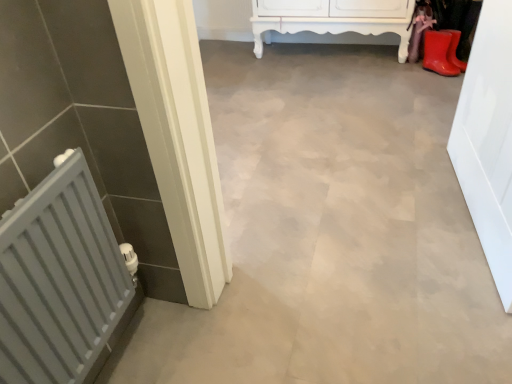
Find the location of `vacant area that lies between white glossy cabinet at upper center and white glossy door at right`. vacant area that lies between white glossy cabinet at upper center and white glossy door at right is located at coordinates (372, 124).